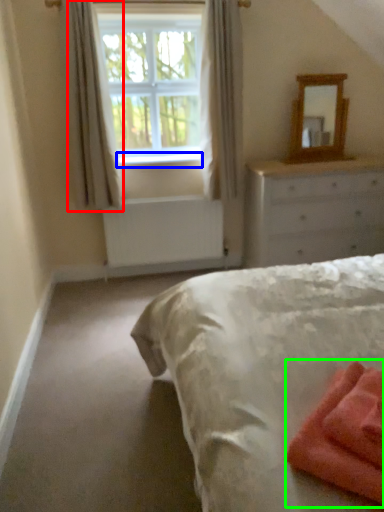
Question: Estimate the real-world distances between objects in this image. Which object is closer to curtain (highlighted by a red box), window sill (highlighted by a blue box) or material (highlighted by a green box)?

Choices:
 (A) window sill
 (B) material

Answer: (A)